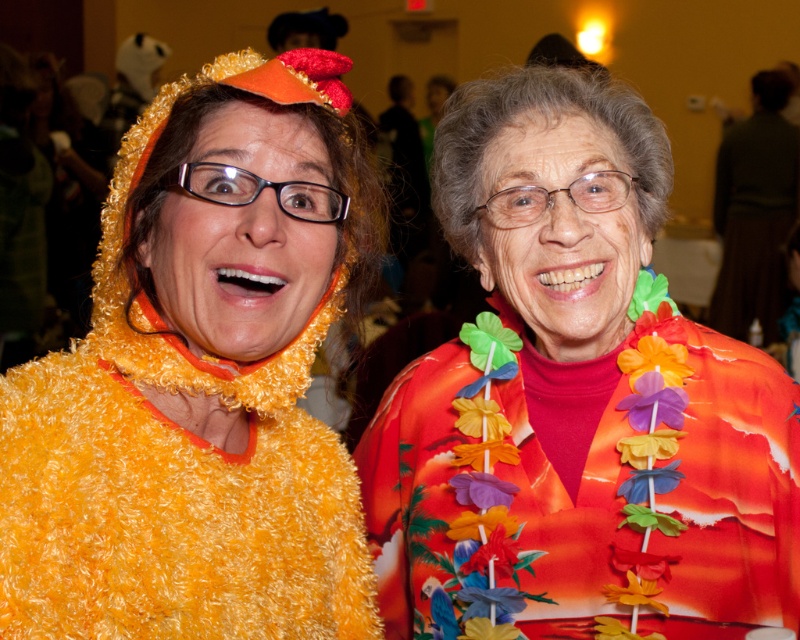
Question: Which object appears closest to the camera in this image?

Choices:
 (A) floral fabric lei at center
 (B) fuzzy yellow costume at left

Answer: (B)

Question: Where is fuzzy yellow costume at left located in relation to floral fabric lei at center in the image?

Choices:
 (A) below
 (B) above

Answer: (B)

Question: Which object is closer to the camera taking this photo?

Choices:
 (A) floral fabric lei at center
 (B) fuzzy yellow costume at left

Answer: (B)

Question: Can you confirm if fuzzy yellow costume at left is positioned above floral fabric lei at center?

Choices:
 (A) yes
 (B) no

Answer: (A)

Question: Can you confirm if fuzzy yellow costume at left is bigger than floral fabric lei at center?

Choices:
 (A) yes
 (B) no

Answer: (B)